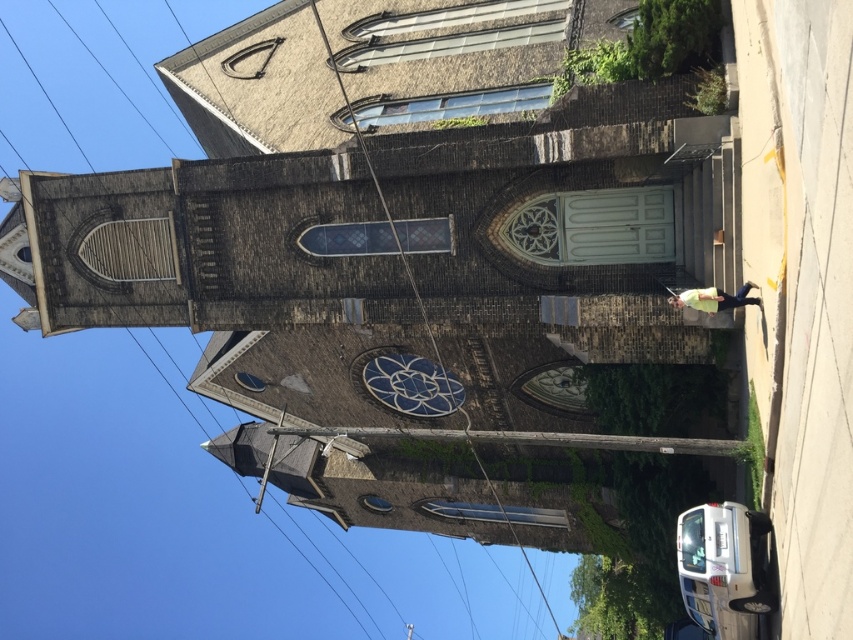
Question: Does wooden pole at center have a lesser width compared to blue stained glass clock at center?

Choices:
 (A) yes
 (B) no

Answer: (B)

Question: Estimate the real-world distances between objects in this image. Which object is farther from the blue stained glass clock at center?

Choices:
 (A) metallic wire at center
 (B) wooden pole at center

Answer: (B)

Question: From the image, what is the correct spatial relationship of wooden pole at center in relation to metallic wire at center?

Choices:
 (A) right
 (B) left

Answer: (B)

Question: Which point is farther to the camera?

Choices:
 (A) (663, 444)
 (B) (415, 292)

Answer: (B)

Question: Among these objects, which one is farthest from the camera?

Choices:
 (A) blue stained glass clock at center
 (B) wooden pole at center
 (C) metallic wire at center

Answer: (A)

Question: Does blue stained glass clock at center lie behind metallic wire at center?

Choices:
 (A) yes
 (B) no

Answer: (A)